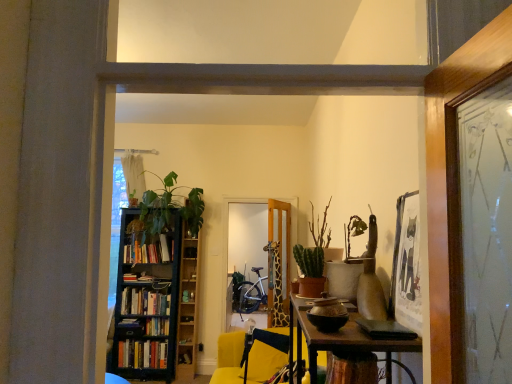
Question: Based on their positions, is green matte plant at center located to the left or right of wooden giraffe at center?

Choices:
 (A) left
 (B) right

Answer: (B)

Question: Is green matte plant at center inside the boundaries of wooden giraffe at center, or outside?

Choices:
 (A) inside
 (B) outside

Answer: (B)

Question: Based on their relative distances, which object is farther from the hardcover books at left, acting as the fourth book starting from the top?

Choices:
 (A) wooden giraffe at center
 (B) green matte plant at left, arranged as the second plant when viewed from the right
 (C) green matte cactus at center-right, which ranks as the first plant in right-to-left order
 (D) hardcover book at left, the 3th book from the top
 (E) wooden bookshelf at center-left

Answer: (C)

Question: Which of these objects is positioned farthest from the black wooden bookcase at left?

Choices:
 (A) wooden giraffe at center
 (B) hardcover books at left, acting as the fourth book starting from the top
 (C) green matte plant at center
 (D) hardcover books at left, the first book viewed from the top
 (E) yellow fabric chair at center

Answer: (C)